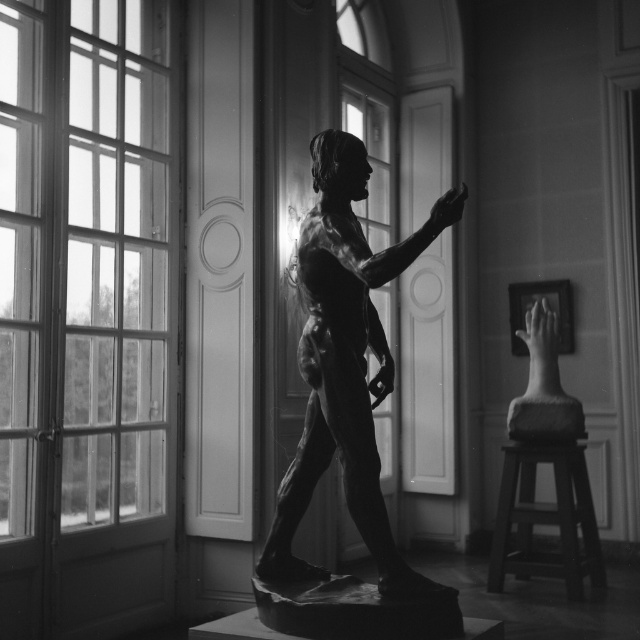
Question: Estimate the real-world distances between objects in this image. Which object is farther from the clear glass window at left?

Choices:
 (A) smooth stone hand at right
 (B) smooth wood stool at lower right

Answer: (B)

Question: Among these objects, which one is farthest from the camera?

Choices:
 (A) smooth stone hand at right
 (B) polished bronze statue at center
 (C) clear glass window at left

Answer: (A)

Question: Can you confirm if clear glass window at left is smaller than smooth stone hand at right?

Choices:
 (A) yes
 (B) no

Answer: (A)

Question: Which point is closer to the camera?

Choices:
 (A) smooth stone hand at right
 (B) clear glass window at left

Answer: (B)

Question: Is clear glass window at left to the left of smooth wood stool at lower right from the viewer's perspective?

Choices:
 (A) no
 (B) yes

Answer: (B)

Question: Is clear glass window at left wider than polished bronze statue at center?

Choices:
 (A) yes
 (B) no

Answer: (B)